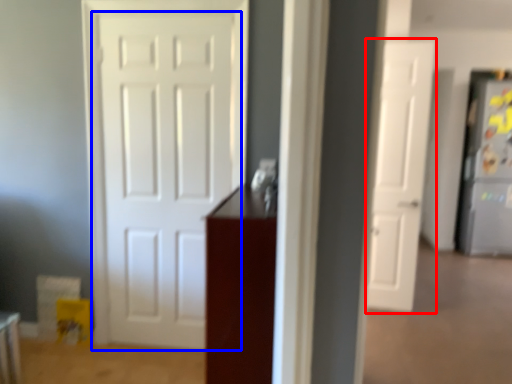
Question: Which object appears closest to the camera in this image, door (highlighted by a red box) or door (highlighted by a blue box)?

Choices:
 (A) door
 (B) door

Answer: (B)